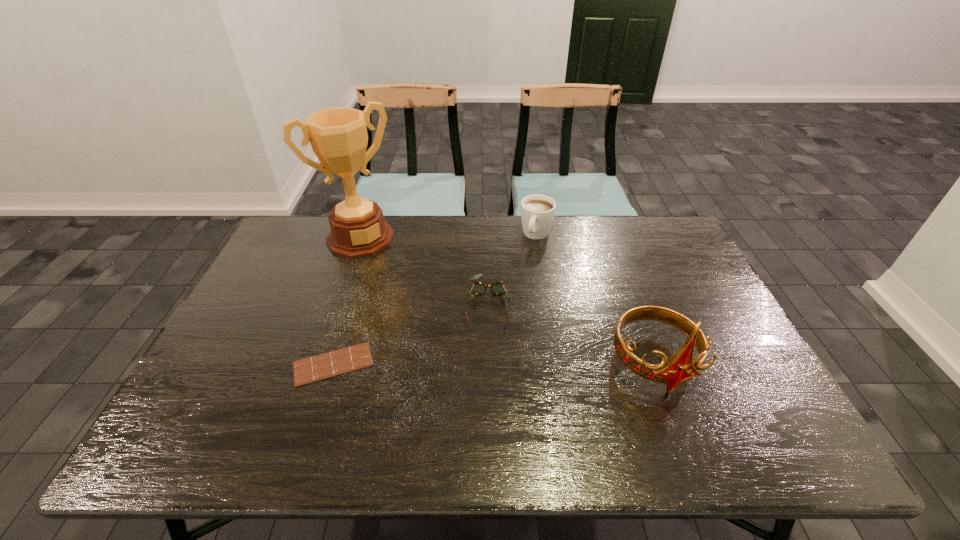
Find the location of a particular element. The width and height of the screenshot is (960, 540). vacant point at the far left corner is located at coordinates (316, 233).

The width and height of the screenshot is (960, 540). Find the location of `vacant space at the near left corner of the desktop`. vacant space at the near left corner of the desktop is located at coordinates (204, 415).

Locate an element on the screen. The height and width of the screenshot is (540, 960). free space at the far right corner is located at coordinates (678, 235).

Locate an element on the screen. This screenshot has height=540, width=960. unoccupied position between the shortest object and the tallest object is located at coordinates (347, 301).

Identify the location of unoccupied area between the tiara and the chocolate bar. The height and width of the screenshot is (540, 960). (493, 363).

At what (x,y) coordinates should I click in order to perform the action: click on free space that is in between the second tallest object and the spectacles. Please return your answer as a coordinate pair (x, y). The width and height of the screenshot is (960, 540). Looking at the image, I should click on (571, 334).

Find the location of a particular element. The height and width of the screenshot is (540, 960). vacant space in between the fourth tallest object and the third tallest object is located at coordinates (512, 269).

This screenshot has height=540, width=960. I want to click on unoccupied area between the award and the fourth tallest object, so click(x=424, y=271).

Locate an element on the screen. free space between the second object from right to left and the third object from left to right is located at coordinates (512, 269).

I want to click on unoccupied position between the shortest object and the fourth shortest object, so click(x=493, y=363).